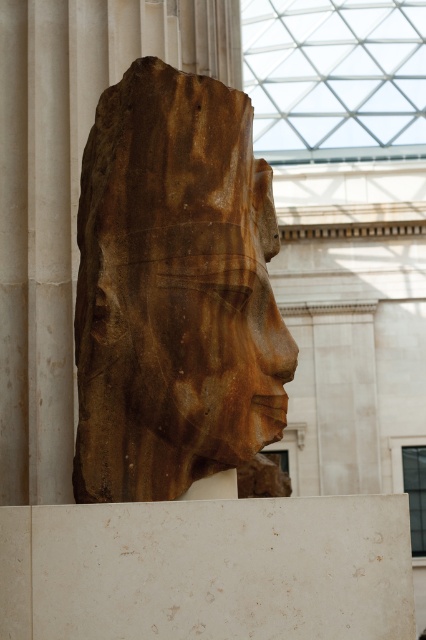
Question: Considering the relative positions of brown stone head at center and brown stone face at center in the image provided, where is brown stone head at center located with respect to brown stone face at center?

Choices:
 (A) left
 (B) right

Answer: (A)

Question: Does brown stone head at center appear under brown stone face at center?

Choices:
 (A) no
 (B) yes

Answer: (A)

Question: Which point is farther to the camera?

Choices:
 (A) (235, 259)
 (B) (204, 156)

Answer: (B)

Question: Is brown stone head at center behind brown stone face at center?

Choices:
 (A) yes
 (B) no

Answer: (A)

Question: Which point is farther to the camera?

Choices:
 (A) brown stone head at center
 (B) brown stone face at center

Answer: (A)